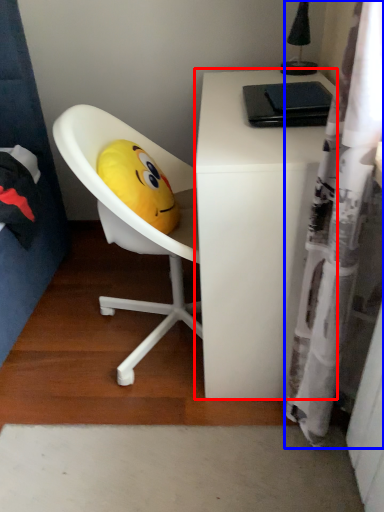
Question: Among these objects, which one is nearest to the camera, desk (highlighted by a red box) or shower curtain (highlighted by a blue box)?

Choices:
 (A) desk
 (B) shower curtain

Answer: (B)